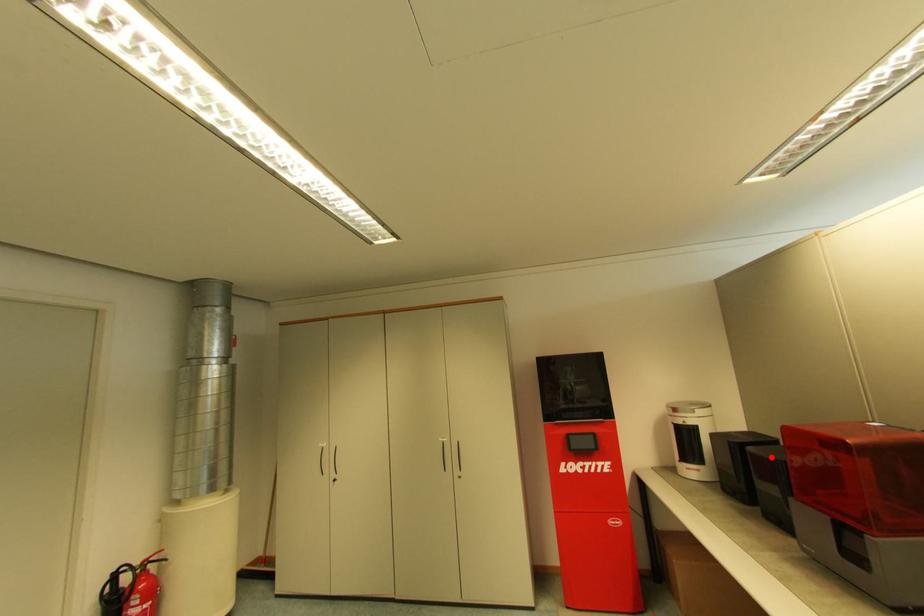
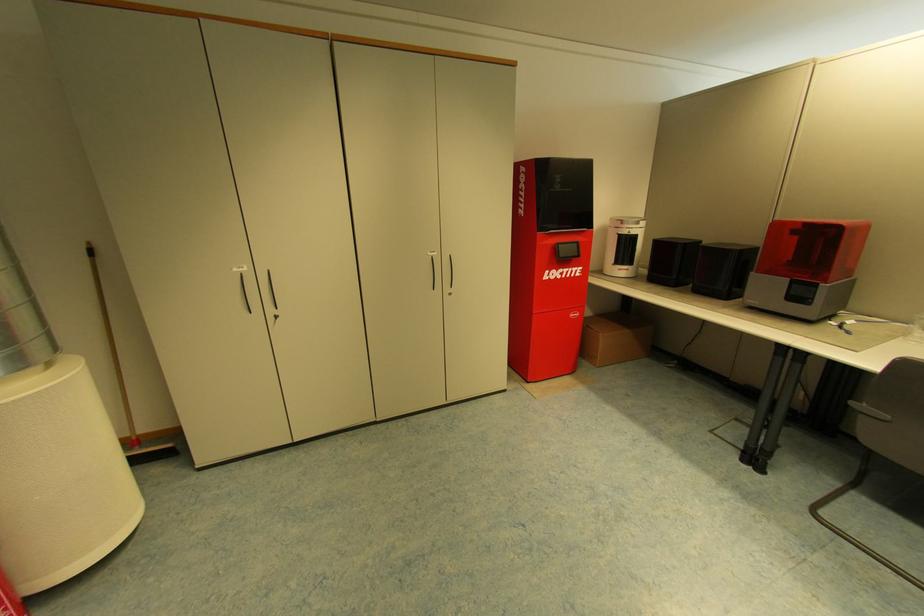
The point at the highlighted location is marked in the first image. Where is the corresponding point in the second image?

(733, 248)